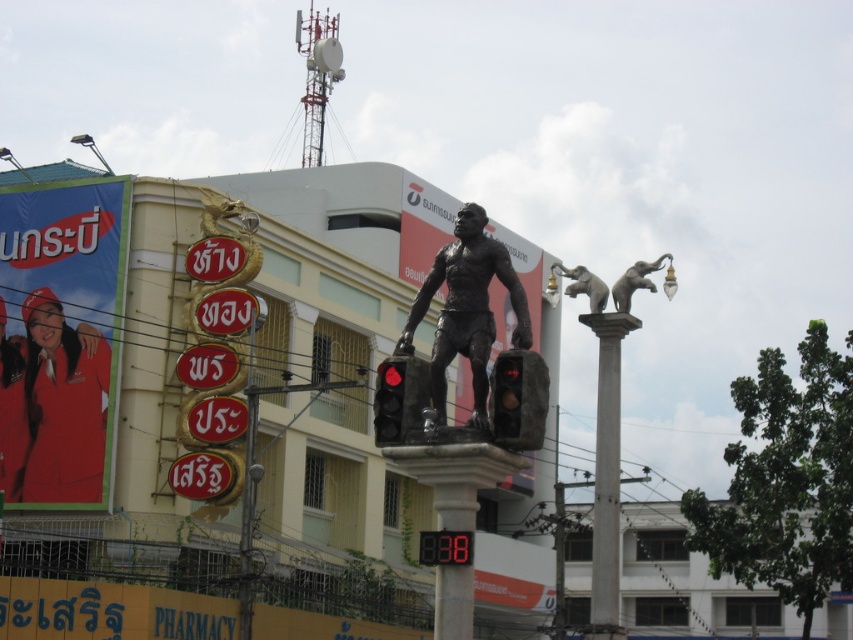
Which of these two, metallic traffic light at center or sculpted stone elephant at upper right, stands taller?

metallic traffic light at center

Can you confirm if metallic traffic light at center is wider than sculpted stone elephant at upper right?

Incorrect, metallic traffic light at center's width does not surpass sculpted stone elephant at upper right's.

Does point (384, 442) lie behind point (643, 282)?

No, it is in front of (643, 282).

Find the location of `metallic traffic light at center`. metallic traffic light at center is located at coordinates (399, 400).

Describe the element at coordinates (466, 308) in the screenshot. This screenshot has width=853, height=640. I see `bronze statue at center` at that location.

Between point (473, 342) and point (521, 353), which one is positioned in front?

Positioned in front is point (521, 353).

Is point (518, 284) more distant than point (538, 358)?

Yes, it is.

Where is `bronze statue at center`? The height and width of the screenshot is (640, 853). bronze statue at center is located at coordinates (466, 308).

Does bronze statue at center appear on the right side of gray concrete column at center?

In fact, bronze statue at center is to the left of gray concrete column at center.

Does bronze statue at center come in front of gray concrete column at center?

Yes, bronze statue at center is closer to the viewer.

Is point (431, 273) positioned before point (611, 346)?

Yes, it is in front of point (611, 346).

Find the location of a particular element. The width and height of the screenshot is (853, 640). bronze statue at center is located at coordinates (466, 308).